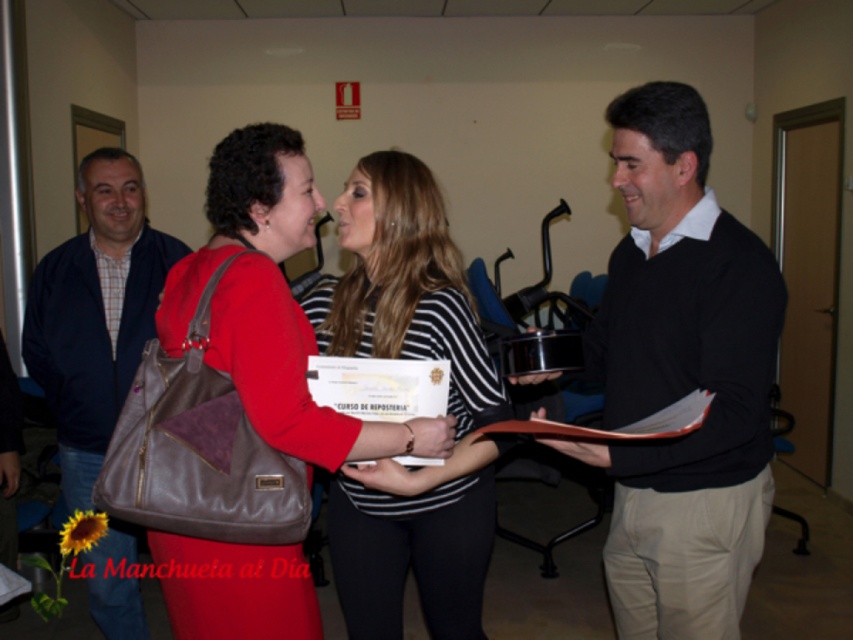
Based on the photo, you are organizing a photo shoot and need to position a prop between the black sweater at center and the matte brown bag at center. To ensure it doesn

The black sweater at center is to the right of the matte brown bag at center, so placing the prop to the left of the matte brown bag at center or to the right of the black sweater at center would keep it between them.

You are at a formal event and need to hand a document to the person wearing the striped fabric shirt at center without disturbing the person holding the matte brown bag at center. Which object should you approach first?

The striped fabric shirt at center is closer to you than the matte brown bag at center, so you should approach the striped fabric shirt at center first to hand the document without disturbing the person holding the matte brown bag at center.

You are standing in the conference room and see two points marked in the image. Which point, point (723, 298) or point (292, 196), is closer to you?

Point (723, 298) is closer to the viewer than point (292, 196).